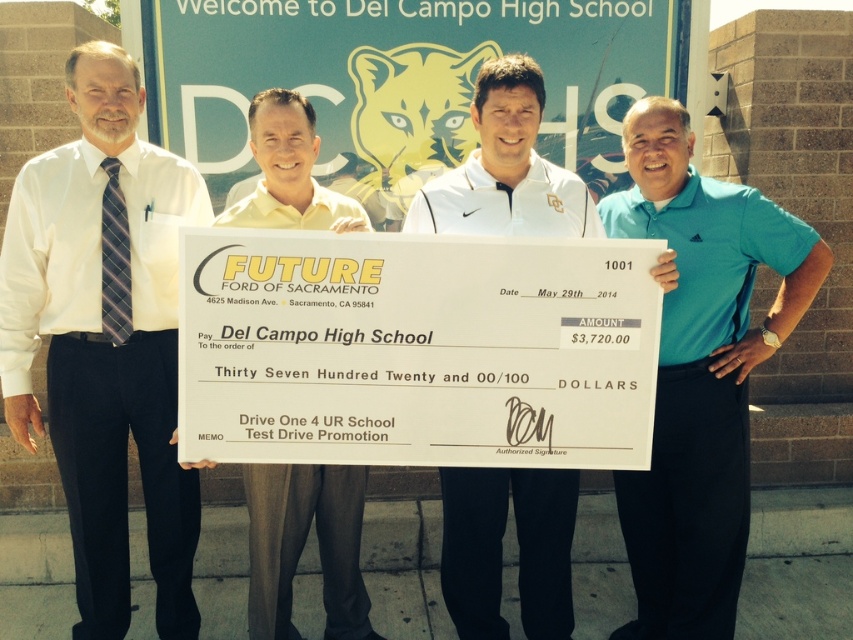
Question: Is white shirt at left below teal polo shirt at right?

Choices:
 (A) yes
 (B) no

Answer: (B)

Question: Considering the real-world distances, which object is closest to the yellow shirt at center?

Choices:
 (A) white shirt at left
 (B) teal polo shirt at right

Answer: (A)

Question: Does white matte shirt at center appear over yellow shirt at center?

Choices:
 (A) yes
 (B) no

Answer: (B)

Question: Which point appears farthest from the camera in this image?

Choices:
 (A) click(569, 224)
 (B) click(776, 298)

Answer: (B)

Question: Can you confirm if white shirt at left is wider than teal polo shirt at right?

Choices:
 (A) no
 (B) yes

Answer: (A)

Question: Based on their relative distances, which object is farther from the teal polo shirt at right?

Choices:
 (A) white shirt at left
 (B) yellow shirt at center

Answer: (A)